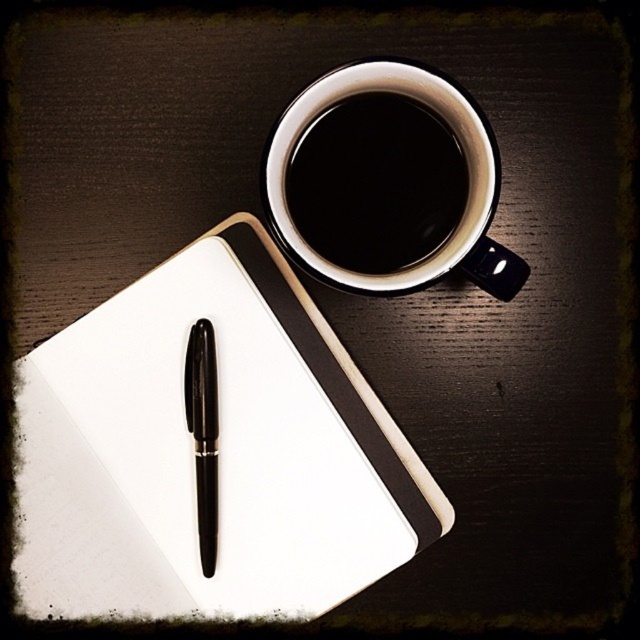
You are trying to place a 1.5 centimeter wide coaster between the two mugs. Based on the image, will the coaster fit between the black ceramic mug at upper center and the black glossy mug at upper center?

The distance between the black ceramic mug at upper center and the black glossy mug at upper center is 1.11 centimeters, which is less than the coaster width of 1.5 centimeters. Therefore, the coaster will not fit between them.

You are an artist trying to sketch the scene from above. You want to draw the white matte notepad at upper left and the black glossy pen at center accurately. Which object should you draw first to maintain proper perspective?

You should draw the white matte notepad at upper left first because it is closer to the viewer than the black glossy pen at center, so it should be placed in front in your sketch.